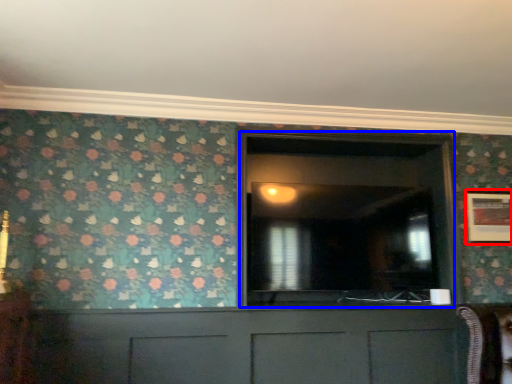
Question: Which object appears closest to the camera in this image, picture frame (highlighted by a red box) or glass door (highlighted by a blue box)?

Choices:
 (A) picture frame
 (B) glass door

Answer: (B)